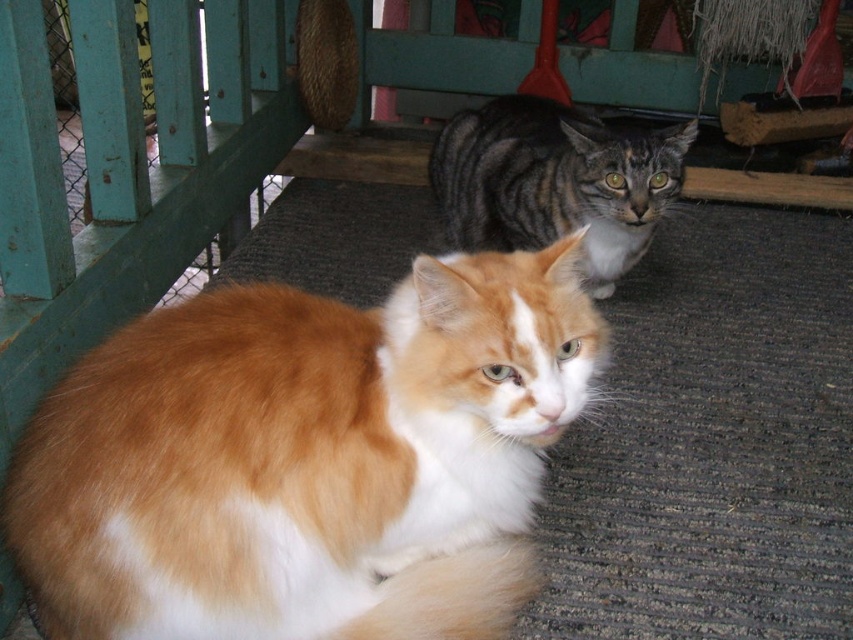
Question: Is fluffy orange-white cat at center closer to the viewer compared to tabby fur cat at center?

Choices:
 (A) no
 (B) yes

Answer: (B)

Question: Which point is farther to the camera?

Choices:
 (A) fluffy orange-white cat at center
 (B) tabby fur cat at center

Answer: (B)

Question: Does fluffy orange-white cat at center have a greater width compared to tabby fur cat at center?

Choices:
 (A) no
 (B) yes

Answer: (B)

Question: Is fluffy orange-white cat at center positioned at the back of tabby fur cat at center?

Choices:
 (A) yes
 (B) no

Answer: (B)

Question: Among these objects, which one is nearest to the camera?

Choices:
 (A) fluffy orange-white cat at center
 (B) tabby fur cat at center

Answer: (A)